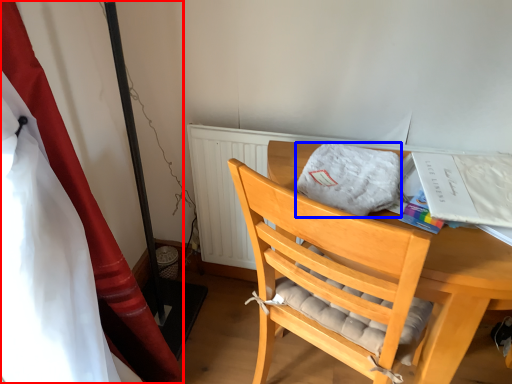
Question: Among these objects, which one is nearest to the camera, curtain (highlighted by a red box) or cloth (highlighted by a blue box)?

Choices:
 (A) curtain
 (B) cloth

Answer: (A)